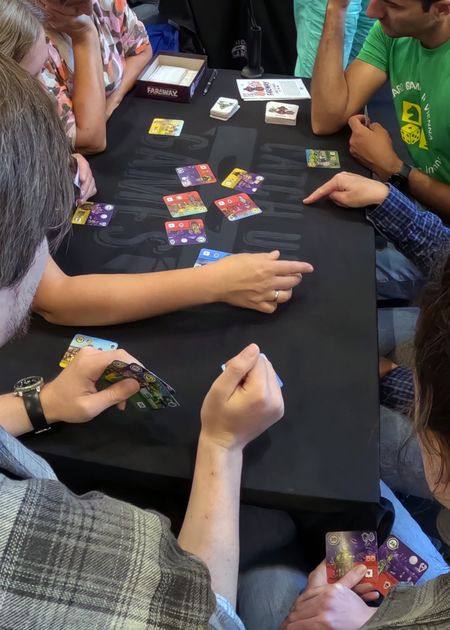
Where is `black table cloth on table`? This screenshot has height=630, width=450. black table cloth on table is located at coordinates (302, 465).